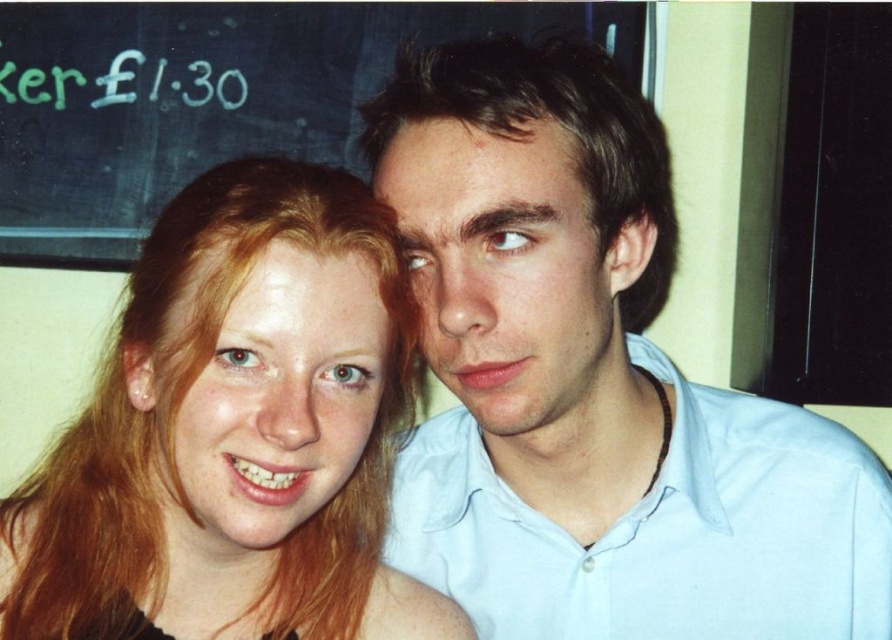
Is light blue cotton shirt at right shorter than black chalkboard at upper left?

Yes.

Is point (747, 481) farther from camera compared to point (141, 6)?

No.

Where is `light blue cotton shirt at right`? The height and width of the screenshot is (640, 892). light blue cotton shirt at right is located at coordinates (662, 531).

Describe the element at coordinates (593, 384) in the screenshot. I see `light blue shirt at center` at that location.

Is light blue shirt at center shorter than blonde hair at left?

No, light blue shirt at center is not shorter than blonde hair at left.

What do you see at coordinates (593, 384) in the screenshot? The height and width of the screenshot is (640, 892). I see `light blue shirt at center` at bounding box center [593, 384].

Locate an element on the screen. Image resolution: width=892 pixels, height=640 pixels. light blue shirt at center is located at coordinates (593, 384).

Describe the element at coordinates (593, 384) in the screenshot. I see `light blue shirt at center` at that location.

Measure the distance between point (467, 365) and camera.

Point (467, 365) is 26.21 inches away from camera.

Identify the location of light blue shirt at center. The width and height of the screenshot is (892, 640). (593, 384).